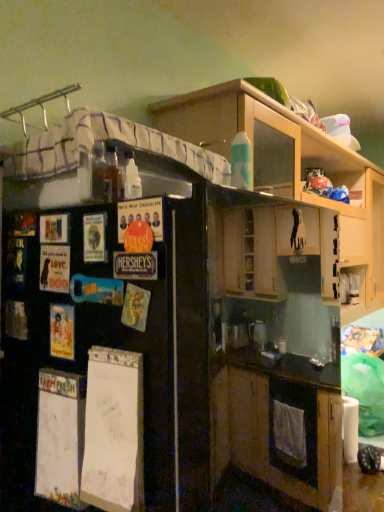
What do you see at coordinates (109, 362) in the screenshot? This screenshot has width=384, height=512. I see `black matte refrigerator at left` at bounding box center [109, 362].

Image resolution: width=384 pixels, height=512 pixels. Describe the element at coordinates (54, 268) in the screenshot. I see `matte paper poster at left, placed as the 1th poster when sorted from back to front` at that location.

What do you see at coordinates (290, 168) in the screenshot? The image size is (384, 512). I see `wooden cabinets at upper center` at bounding box center [290, 168].

At what (x,y) coordinates should I click in order to perform the action: click on matte paper poster at left, marked as the 2th poster in a right-to-left arrangement. Please return your answer as a coordinate pair (x, y). The height and width of the screenshot is (512, 384). Looking at the image, I should click on (62, 331).

The image size is (384, 512). What do you see at coordinates (141, 215) in the screenshot?
I see `matte cardboard poster at left, which appears as the 1th poster when viewed from the front` at bounding box center [141, 215].

The width and height of the screenshot is (384, 512). Find the location of `black matte refrigerator at left`. black matte refrigerator at left is located at coordinates (109, 362).

Is matte cardboard poster at left, which appears as the 1th poster when viewed from the front, oriented away from matte paper poster at left, the 3th poster from the right?

No, matte cardboard poster at left, which appears as the 1th poster when viewed from the front,'s orientation is not away from matte paper poster at left, the 3th poster from the right.

In order to click on poster above the matte paper poster at left, arranged as the third poster when viewed from the front (from a real-world perspective) in this screenshot , I will do `click(141, 215)`.

Between matte cardboard poster at left, arranged as the first poster when viewed from the right, and matte paper poster at left, the 2th poster ordered from the bottom, which one has smaller size?

With smaller size is matte paper poster at left, the 2th poster ordered from the bottom.

In the image, is matte cardboard poster at left, the 1th poster positioned from the top, positioned in front of or behind matte paper poster at left, placed as the 1th poster when sorted from back to front?

In the image, matte cardboard poster at left, the 1th poster positioned from the top, appears in front of matte paper poster at left, placed as the 1th poster when sorted from back to front.

Considering the points (277, 172) and (68, 350), which point is behind, point (277, 172) or point (68, 350)?

The point (277, 172) is behind.

Can you see wooden cabinets at upper center touching matte paper poster at left, the 1th poster ordered from the bottom?

wooden cabinets at upper center and matte paper poster at left, the 1th poster ordered from the bottom, are not in contact.

Which of these two, wooden cabinets at upper center or matte paper poster at left, marked as the 2th poster in a right-to-left arrangement, is wider?

wooden cabinets at upper center is wider.

From the image's perspective, is wooden cabinets at upper center beneath matte paper poster at left, the 1th poster ordered from the bottom?

No, from the image's perspective, wooden cabinets at upper center is not beneath matte paper poster at left, the 1th poster ordered from the bottom.

The image size is (384, 512). What are the coordinates of `cabinetry that appears on the right of matte cardboard poster at left, the third poster in the left-to-right sequence` in the screenshot? It's located at (290, 168).

How far apart are wooden cabinets at upper center and matte cardboard poster at left, which is counted as the third poster, starting from the back?

They are 1.27 meters apart.

Is wooden cabinets at upper center aimed at matte cardboard poster at left, the 3th poster positioned from the bottom?

No, wooden cabinets at upper center is not oriented towards matte cardboard poster at left, the 3th poster positioned from the bottom.

Which object is closer to the camera taking this photo, wooden cabinets at upper center or matte cardboard poster at left, which is counted as the third poster, starting from the back?

matte cardboard poster at left, which is counted as the third poster, starting from the back, is more forward.

Does matte paper poster at left, the 3th poster from the right, have a lesser width compared to matte cardboard poster at left, the 1th poster positioned from the top?

Correct, the width of matte paper poster at left, the 3th poster from the right, is less than that of matte cardboard poster at left, the 1th poster positioned from the top.

Is matte paper poster at left, positioned as the 2th poster in top-to-bottom order, taller or shorter than matte cardboard poster at left, the 1th poster positioned from the top?

matte paper poster at left, positioned as the 2th poster in top-to-bottom order, is taller than matte cardboard poster at left, the 1th poster positioned from the top.

Which is correct: matte paper poster at left, arranged as the third poster when viewed from the front, is inside matte cardboard poster at left, the 3th poster positioned from the bottom, or outside of it?

matte paper poster at left, arranged as the third poster when viewed from the front, lies outside matte cardboard poster at left, the 3th poster positioned from the bottom.

From a real-world perspective, is matte paper poster at left, the 2th poster ordered from the bottom, over matte cardboard poster at left, arranged as the first poster when viewed from the right?

Actually, matte paper poster at left, the 2th poster ordered from the bottom, is physically below matte cardboard poster at left, arranged as the first poster when viewed from the right, in the real world.

Is matte paper poster at left, the third poster when ordered from top to bottom, inside the boundaries of matte paper poster at left, placed as the 1th poster when sorted from back to front, or outside?

The correct answer is: outside.

What's the angular difference between matte paper poster at left, which ranks as the 2th poster in left-to-right order, and matte paper poster at left, arranged as the third poster when viewed from the front,'s facing directions?

matte paper poster at left, which ranks as the 2th poster in left-to-right order, and matte paper poster at left, arranged as the third poster when viewed from the front, are facing 0.0394 degrees away from each other.

In the image, is matte paper poster at left, which ranks as the 2th poster in front-to-back order, positioned in front of or behind matte paper poster at left, positioned as the 2th poster in top-to-bottom order?

matte paper poster at left, which ranks as the 2th poster in front-to-back order, is positioned closer to the viewer than matte paper poster at left, positioned as the 2th poster in top-to-bottom order.

Is matte paper poster at left, which ranks as the 2th poster in front-to-back order, positioned far away from matte paper poster at left, arranged as the third poster when viewed from the front?

No, matte paper poster at left, which ranks as the 2th poster in front-to-back order, is in close proximity to matte paper poster at left, arranged as the third poster when viewed from the front.

Would you say wooden cabinets at upper center is outside matte paper poster at left, the 2th poster ordered from the bottom?

Yes, wooden cabinets at upper center is outside of matte paper poster at left, the 2th poster ordered from the bottom.

Considering the sizes of objects wooden cabinets at upper center and matte paper poster at left, arranged as the third poster when viewed from the front, in the image provided, who is shorter, wooden cabinets at upper center or matte paper poster at left, arranged as the third poster when viewed from the front,?

Standing shorter between the two is matte paper poster at left, arranged as the third poster when viewed from the front.

Is point (247, 122) farther from camera compared to point (40, 269)?

Yes, point (247, 122) is farther from viewer.

From the image's perspective, is wooden cabinets at upper center positioned above or below matte paper poster at left, the 2th poster ordered from the bottom?

From the image's perspective, wooden cabinets at upper center appears above matte paper poster at left, the 2th poster ordered from the bottom.

Who is taller, black matte refrigerator at left or matte paper poster at left, placed as the 1th poster when sorted from back to front?

black matte refrigerator at left.

Is black matte refrigerator at left at the left side of matte paper poster at left, arranged as the third poster when viewed from the front?

No.

Is point (179, 332) more distant than point (55, 292)?

No, it is not.

Starting from the matte cardboard poster at left, the 3th poster positioned from the bottom, which poster is the 2nd one to the left? Please provide its 2D coordinates.

[(54, 268)]

Locate an element on the screen. This screenshot has width=384, height=512. cabinetry above the matte paper poster at left, which ranks as the 2th poster in front-to-back order (from a real-world perspective) is located at coordinates (290, 168).

Estimate the real-world distances between objects in this image. Which object is further from matte paper poster at left, the 3th poster from the right, matte cardboard poster at left, the 1th poster positioned from the top, or black matte refrigerator at left?

Based on the image, black matte refrigerator at left appears to be further to matte paper poster at left, the 3th poster from the right.

Looking at the image, which one is located closer to black matte refrigerator at left, wooden cabinets at upper center or matte cardboard poster at left, the 1th poster positioned from the top?

The object closer to black matte refrigerator at left is matte cardboard poster at left, the 1th poster positioned from the top.

When comparing their distances from matte paper poster at left, the third poster when ordered from top to bottom, does black matte refrigerator at left or matte paper poster at left, placed as the 1th poster when sorted from left to right, seem further?

The object further to matte paper poster at left, the third poster when ordered from top to bottom, is black matte refrigerator at left.

Which object lies nearer to the anchor point matte cardboard poster at left, the 3th poster positioned from the bottom, black matte refrigerator at left or matte paper poster at left, positioned as the 2th poster in top-to-bottom order?

matte paper poster at left, positioned as the 2th poster in top-to-bottom order, is positioned closer to the anchor matte cardboard poster at left, the 3th poster positioned from the bottom.

When comparing their distances from matte paper poster at left, which ranks as the 2th poster in left-to-right order, does black matte refrigerator at left or wooden cabinets at upper center seem closer?

Based on the image, black matte refrigerator at left appears to be nearer to matte paper poster at left, which ranks as the 2th poster in left-to-right order.

Based on their spatial positions, is black matte refrigerator at left or matte paper poster at left, which ranks as the 2th poster in left-to-right order, further from matte cardboard poster at left, the third poster in the left-to-right sequence?

black matte refrigerator at left lies further to matte cardboard poster at left, the third poster in the left-to-right sequence, than the other object.

Estimate the real-world distances between objects in this image. Which object is closer to black matte refrigerator at left, matte paper poster at left, marked as the 2th poster in a right-to-left arrangement, or wooden cabinets at upper center?

Based on the image, matte paper poster at left, marked as the 2th poster in a right-to-left arrangement, appears to be nearer to black matte refrigerator at left.

Considering their positions, is wooden cabinets at upper center positioned further to matte paper poster at left, the 2th poster ordered from the bottom, than matte paper poster at left, acting as the 2th poster starting from the back?

Among the two, wooden cabinets at upper center is located further to matte paper poster at left, the 2th poster ordered from the bottom.

Locate an element on the screen. poster between matte paper poster at left, acting as the 2th poster starting from the back, and wooden cabinets at upper center from left to right is located at coordinates (141, 215).

Where is `refrigerator located between matte paper poster at left, placed as the 1th poster when sorted from left to right, and wooden cabinets at upper center in the left-right direction`? This screenshot has width=384, height=512. refrigerator located between matte paper poster at left, placed as the 1th poster when sorted from left to right, and wooden cabinets at upper center in the left-right direction is located at coordinates (109, 362).

Where is `poster between matte cardboard poster at left, the 1th poster positioned from the top, and matte paper poster at left, acting as the 2th poster starting from the back, vertically`? This screenshot has height=512, width=384. poster between matte cardboard poster at left, the 1th poster positioned from the top, and matte paper poster at left, acting as the 2th poster starting from the back, vertically is located at coordinates (54, 268).

Where is `refrigerator situated between matte paper poster at left, marked as the 2th poster in a right-to-left arrangement, and wooden cabinets at upper center from left to right`? This screenshot has width=384, height=512. refrigerator situated between matte paper poster at left, marked as the 2th poster in a right-to-left arrangement, and wooden cabinets at upper center from left to right is located at coordinates (109, 362).